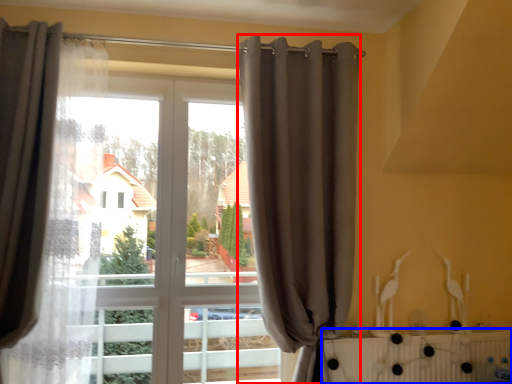
Question: Which point is closer to the camera, curtain (highlighted by a red box) or radiator (highlighted by a blue box)?

Choices:
 (A) curtain
 (B) radiator

Answer: (A)